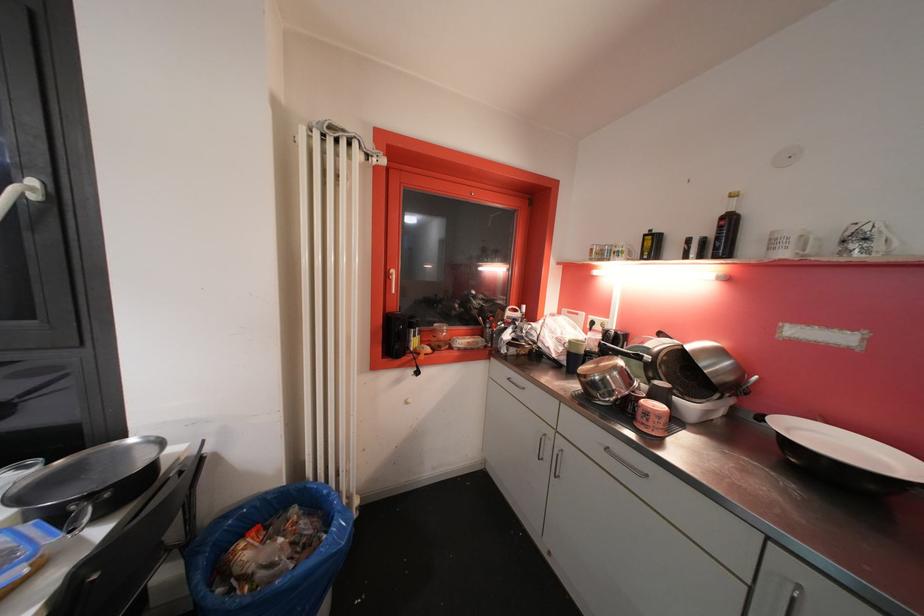
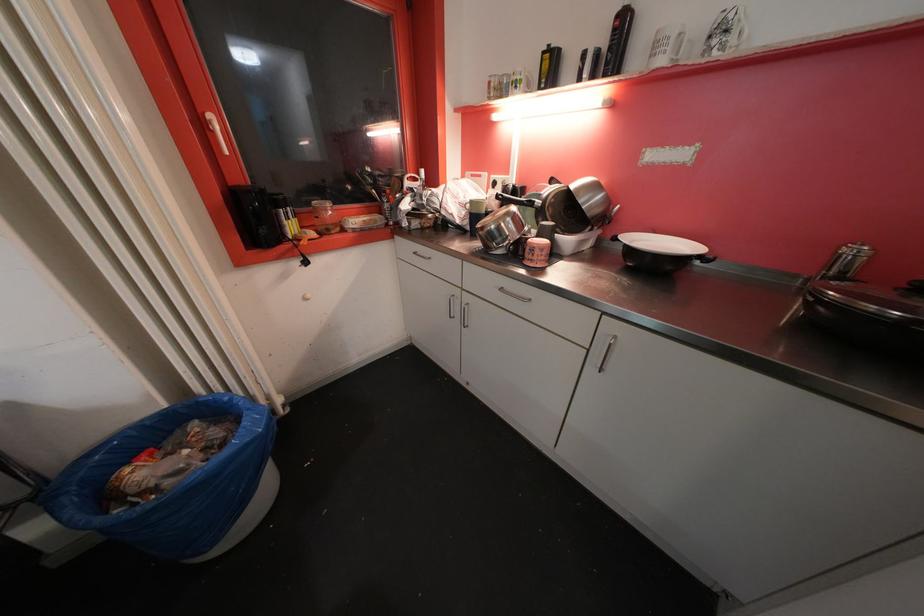
The point at (635, 413) is marked in the first image. Where is the corresponding point in the second image?

(526, 254)